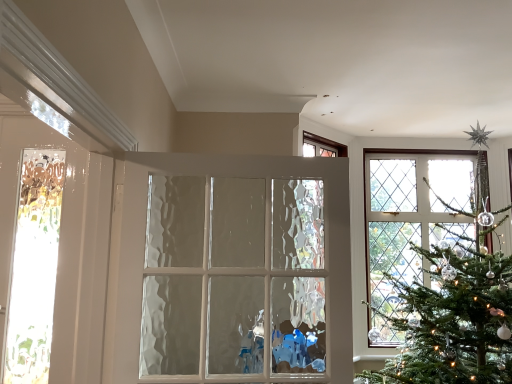
Question: Is translucent glass door at left, the second door when ordered from right to left, oriented towards white textured glass door at center, which ranks as the 2th door in left-to-right order?

Choices:
 (A) no
 (B) yes

Answer: (A)

Question: Can white textured glass door at center, the first door when ordered from right to left, be found inside translucent glass door at left, the second door when ordered from right to left?

Choices:
 (A) no
 (B) yes

Answer: (A)

Question: Is translucent glass door at left, the second door when ordered from right to left, next to white textured glass door at center, which ranks as the 2th door in left-to-right order?

Choices:
 (A) yes
 (B) no

Answer: (B)

Question: From a real-world perspective, is translucent glass door at left, the second door when ordered from right to left, below white textured glass door at center, which ranks as the 2th door in left-to-right order?

Choices:
 (A) yes
 (B) no

Answer: (B)

Question: Does translucent glass door at left, the second door when ordered from right to left, appear on the left side of white textured glass door at center, which ranks as the 2th door in left-to-right order?

Choices:
 (A) yes
 (B) no

Answer: (A)

Question: Is translucent glass door at left, the second door when ordered from right to left, facing away from white textured glass door at center, the first door when ordered from right to left?

Choices:
 (A) no
 (B) yes

Answer: (A)

Question: Can you see white textured glass door at center, which ranks as the 2th door in left-to-right order, touching translucent glass door at left, the second door when ordered from right to left?

Choices:
 (A) no
 (B) yes

Answer: (A)

Question: Is white textured glass door at center, the first door when ordered from right to left, turned away from translucent glass door at left, the second door when ordered from right to left?

Choices:
 (A) yes
 (B) no

Answer: (B)

Question: Is white textured glass door at center, which ranks as the 2th door in left-to-right order, facing towards translucent glass door at left, which appears as the first door when viewed from the left?

Choices:
 (A) yes
 (B) no

Answer: (B)

Question: From the image's perspective, does white textured glass door at center, the first door when ordered from right to left, appear higher than translucent glass door at left, which appears as the first door when viewed from the left?

Choices:
 (A) no
 (B) yes

Answer: (A)

Question: Does white textured glass door at center, the first door when ordered from right to left, have a lesser height compared to translucent glass door at left, which appears as the first door when viewed from the left?

Choices:
 (A) no
 (B) yes

Answer: (B)

Question: Considering the relative sizes of white textured glass door at center, the first door when ordered from right to left, and translucent glass door at left, the second door when ordered from right to left, in the image provided, is white textured glass door at center, the first door when ordered from right to left, thinner than translucent glass door at left, the second door when ordered from right to left,?

Choices:
 (A) no
 (B) yes

Answer: (A)

Question: Is point (266, 178) positioned closer to the camera than point (79, 150)?

Choices:
 (A) farther
 (B) closer

Answer: (A)